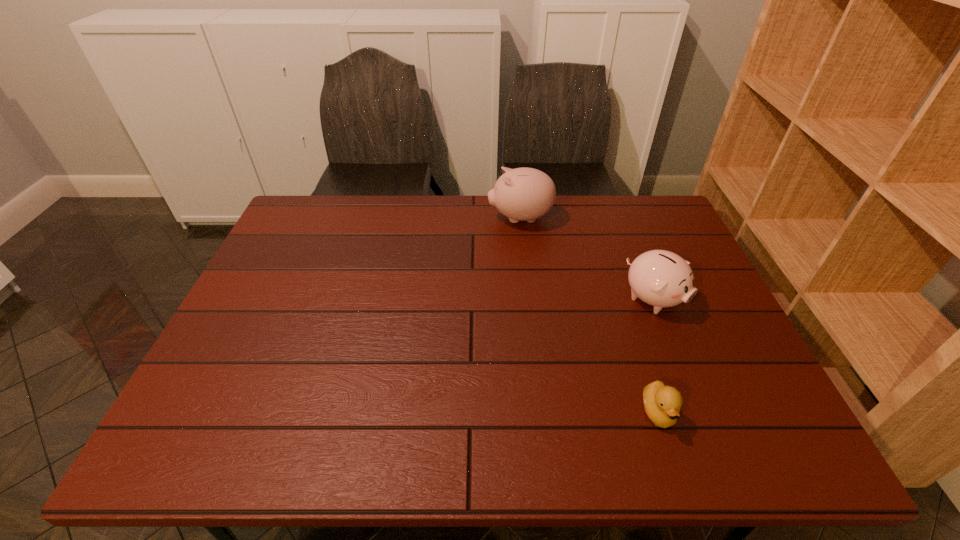
At what (x,y) coordinates should I click in order to perform the action: click on free space between the tallest object and the shortest object. Please return your answer as a coordinate pair (x, y). This screenshot has width=960, height=540. Looking at the image, I should click on (589, 315).

Where is `object that is the second nearest to the nearest object`? The width and height of the screenshot is (960, 540). object that is the second nearest to the nearest object is located at coordinates (522, 194).

Point out which object is positioned as the second nearest to the right piggy bank. Please provide its 2D coordinates. Your answer should be formatted as a tuple, i.e. [(x, y)], where the tuple contains the x and y coordinates of a point satisfying the conditions above.

[(522, 194)]

Where is `vacant space that satisfies the following two spatial constraints: 1. at the snout of the tallest object; 2. on the back side of the second farthest object`? Image resolution: width=960 pixels, height=540 pixels. vacant space that satisfies the following two spatial constraints: 1. at the snout of the tallest object; 2. on the back side of the second farthest object is located at coordinates (529, 299).

You are a GUI agent. You are given a task and a screenshot of the screen. Output one action in this format:
    pyautogui.click(x=<x>, y=<y>)
    Task: Click on the free location that satisfies the following two spatial constraints: 1. on the back side of the second nearest object; 2. at the snout of the farther piggy bank
    
    Given the screenshot: What is the action you would take?
    pyautogui.click(x=621, y=218)

Where is `vacant region that satisfies the following two spatial constraints: 1. at the snout of the second shortest object; 2. on the right side of the tallest object`? vacant region that satisfies the following two spatial constraints: 1. at the snout of the second shortest object; 2. on the right side of the tallest object is located at coordinates (529, 299).

Locate an element on the screen. Image resolution: width=960 pixels, height=540 pixels. vacant space that satisfies the following two spatial constraints: 1. at the snout of the tallest object; 2. on the left side of the second shortest object is located at coordinates (529, 299).

Where is `free space that satisfies the following two spatial constraints: 1. at the snout of the tallest object; 2. on the left side of the shorter piggy bank`? This screenshot has height=540, width=960. free space that satisfies the following two spatial constraints: 1. at the snout of the tallest object; 2. on the left side of the shorter piggy bank is located at coordinates (529, 299).